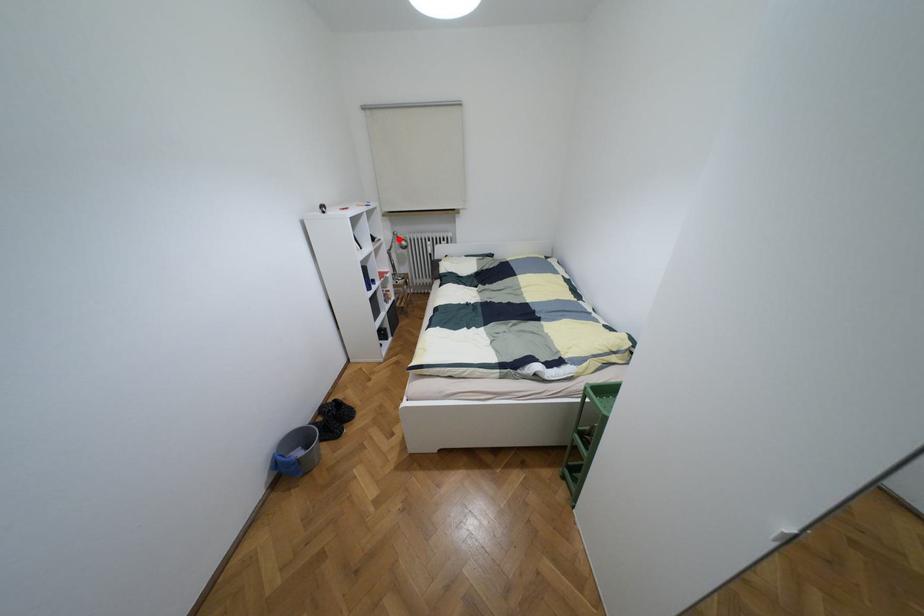
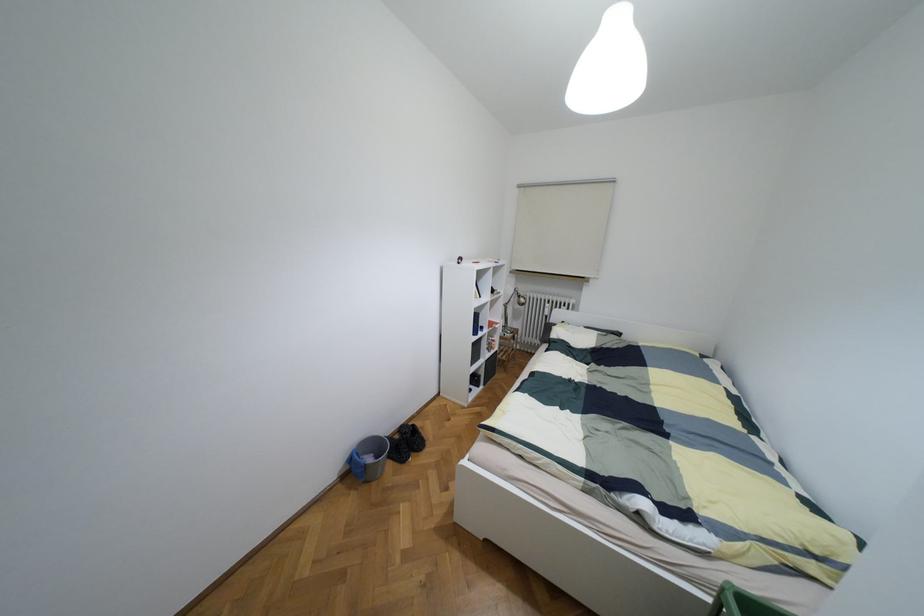
Question: I am providing you with two images of the same scene from different viewpoints. In image1, a red point is highlighted. Considering the same 3D point in image2, which of the following is correct?

Choices:
 (A) It is closer
 (B) It is farther

Answer: (B)